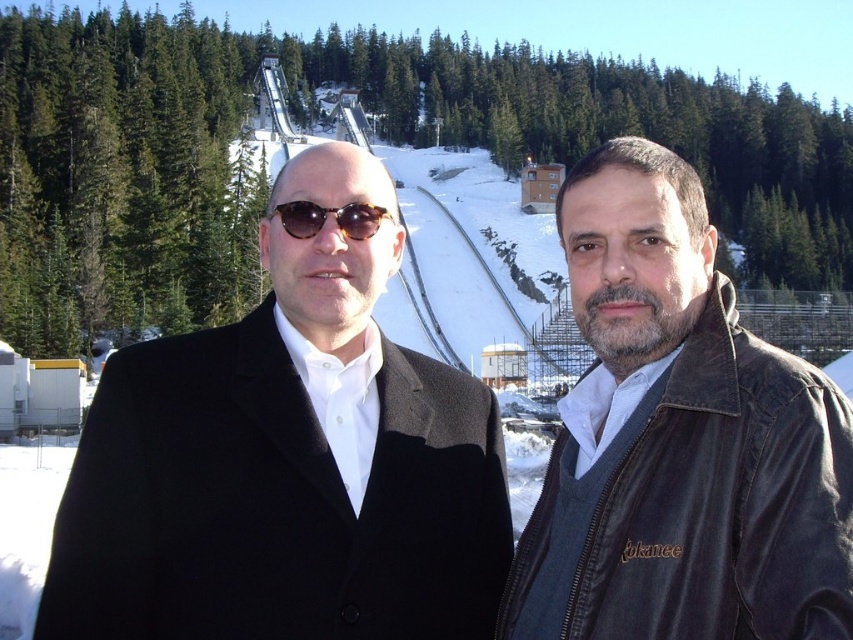
How far apart are black wool coat at left and matte black sunglasses at center?

black wool coat at left and matte black sunglasses at center are 18.24 feet apart from each other.

Does black wool coat at left appear over matte black sunglasses at center?

No.

Locate an element on the screen. The image size is (853, 640). black wool coat at left is located at coordinates (287, 461).

Can you confirm if black wool coat at left is positioned below leather jacket at right?

Yes.

Is black wool coat at left closer to the viewer compared to leather jacket at right?

No, it is behind leather jacket at right.

Who is more forward, (294, 490) or (705, 232)?

Point (294, 490)

Where is `black wool coat at left`? The height and width of the screenshot is (640, 853). black wool coat at left is located at coordinates (287, 461).

Is leather jacket at right in front of matte black sunglasses at center?

Yes, leather jacket at right is in front of matte black sunglasses at center.

Based on the photo, between leather jacket at right and matte black sunglasses at center, which one appears on the left side from the viewer's perspective?

matte black sunglasses at center

Is point (648, 506) in front of point (335, 211)?

Yes, point (648, 506) is in front of point (335, 211).

The width and height of the screenshot is (853, 640). Identify the location of leather jacket at right. (679, 440).